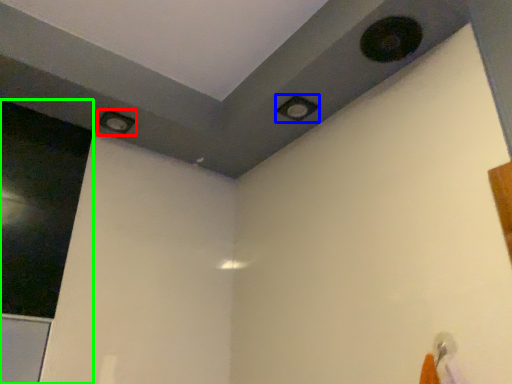
Question: Which object is the farthest from hole (highlighted by a red box)? Choose among these: hole (highlighted by a blue box) or screen door (highlighted by a green box).

Choices:
 (A) hole
 (B) screen door

Answer: (A)